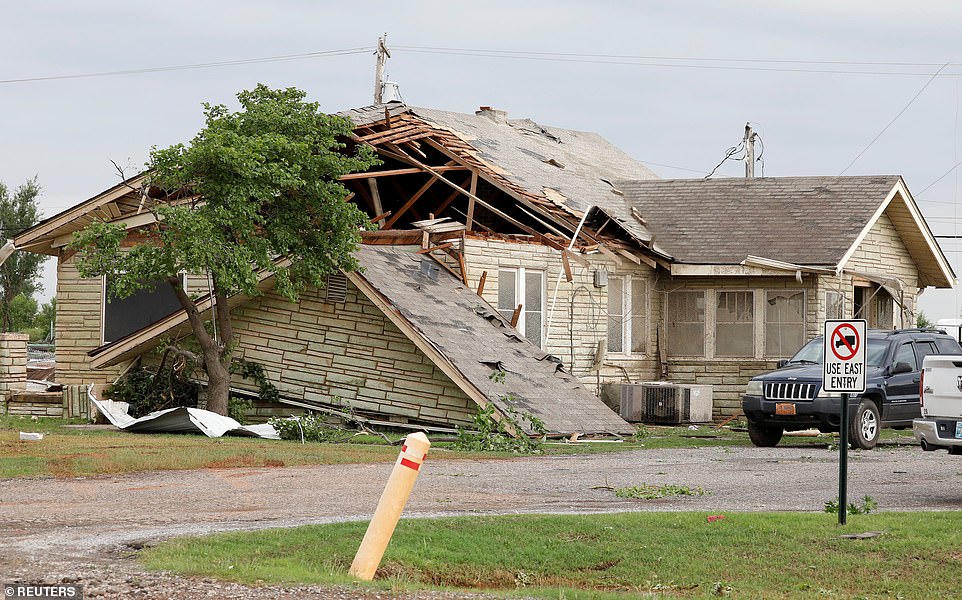
The height and width of the screenshot is (600, 962). I want to click on vent, so click(333, 287).